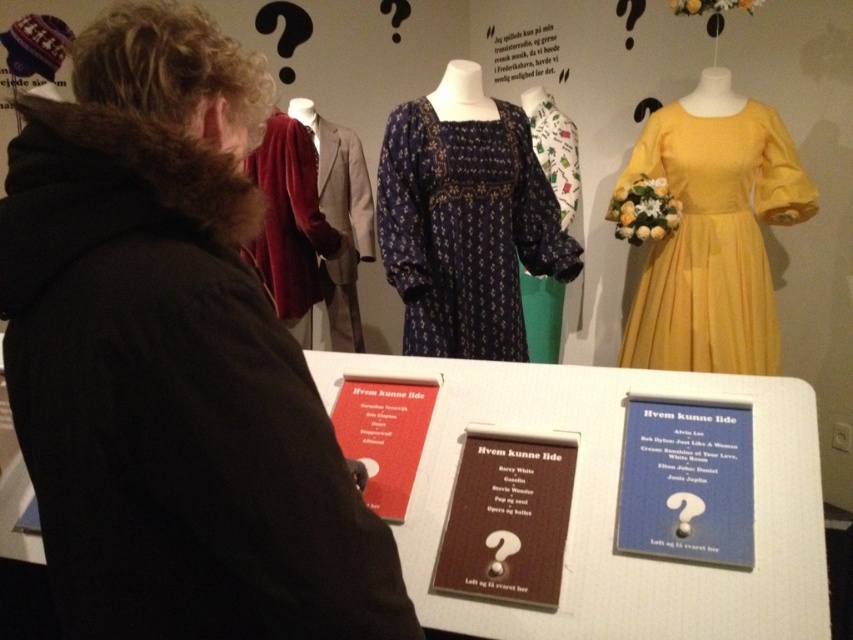
Question: Is velvety red dress at upper left bigger than yellow satin dress at upper right?

Choices:
 (A) no
 (B) yes

Answer: (A)

Question: Does velvety red dress at upper left appear under yellow satin dress at upper right?

Choices:
 (A) no
 (B) yes

Answer: (B)

Question: Among these objects, which one is nearest to the camera?

Choices:
 (A) matte brown card at center
 (B) blue paper at center

Answer: (B)

Question: Can you confirm if yellow satin dress at upper right is positioned to the left of matte brown card at center?

Choices:
 (A) no
 (B) yes

Answer: (A)

Question: Which point is farther from the camera taking this photo?

Choices:
 (A) (496, 577)
 (B) (115, 358)

Answer: (A)

Question: Which of these objects is positioned farthest from the matte brown card at center?

Choices:
 (A) matte red book at center
 (B) yellow satin dress at upper right
 (C) velvet red robe at left
 (D) velvety red dress at upper left

Answer: (C)